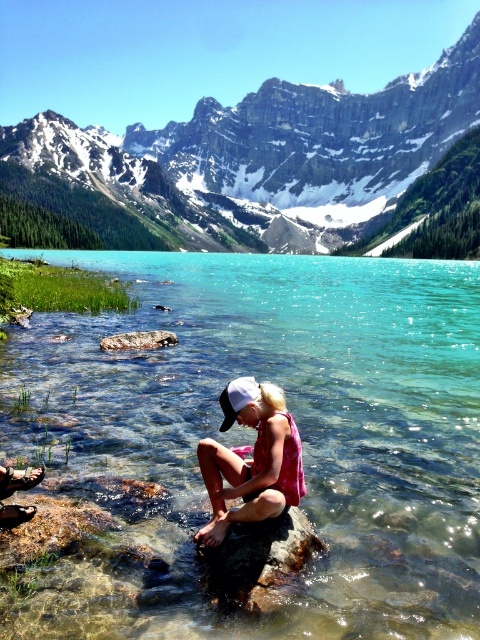
Question: Which object is positioned farthest from the snowy granite mountain at upper center?

Choices:
 (A) clear glassy water at center
 (B) smooth gray rock at lower left

Answer: (B)

Question: Is snowy granite mountain at upper center thinner than pink fabric at center?

Choices:
 (A) yes
 (B) no

Answer: (B)

Question: Is clear glassy water at center above pink fabric at center?

Choices:
 (A) yes
 (B) no

Answer: (A)

Question: Which is farther from the snowy granite mountain at upper center?

Choices:
 (A) clear glassy water at center
 (B) pink fabric at center
 (C) smooth gray rock at lower center

Answer: (C)

Question: Does smooth gray rock at lower center come behind smooth gray rock at lower left?

Choices:
 (A) yes
 (B) no

Answer: (B)

Question: Which point is closer to the camera?

Choices:
 (A) smooth gray rock at lower center
 (B) pink fabric at center

Answer: (A)